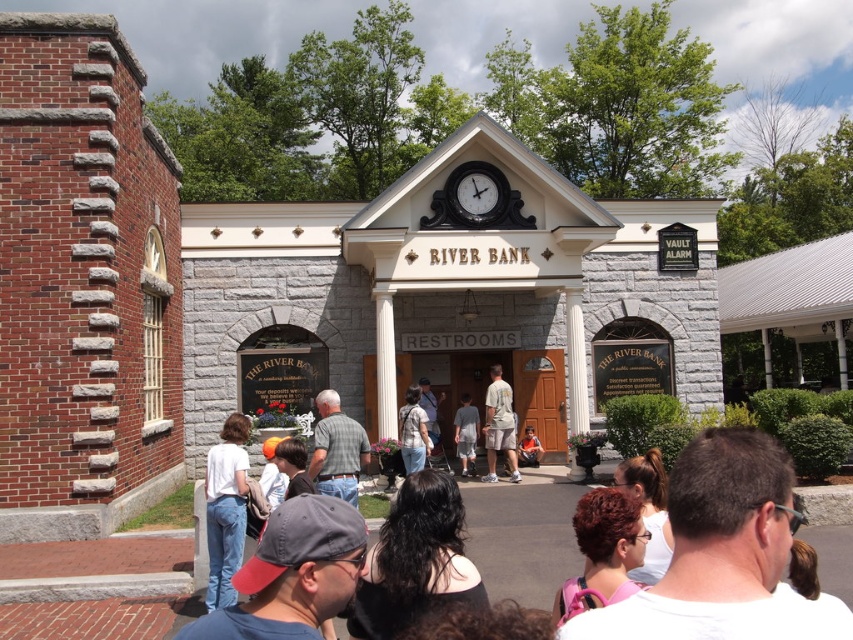
Question: Among these objects, which one is nearest to the camera?

Choices:
 (A) white cotton shirt at center
 (B) denim shirt at center
 (C) light brown fabric shorts at center
 (D) plaid shirt at center

Answer: (A)

Question: Does plaid shirt at center come in front of gray cotton shorts at center?

Choices:
 (A) yes
 (B) no

Answer: (A)

Question: Is light brown fabric shorts at center thinner than denim shirt at center?

Choices:
 (A) yes
 (B) no

Answer: (B)

Question: Does plaid shirt at center come in front of gray cotton shorts at center?

Choices:
 (A) no
 (B) yes

Answer: (B)

Question: Which point is farther from the camera taking this photo?

Choices:
 (A) (238, 451)
 (B) (363, 444)
 (C) (399, 435)

Answer: (C)

Question: Which object is closer to the camera taking this photo?

Choices:
 (A) plaid shirt at center
 (B) gray cotton shorts at center
 (C) light brown fabric shorts at center

Answer: (A)